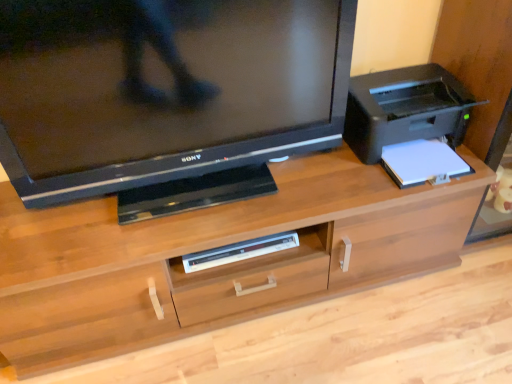
Question: From the image's perspective, is wooden desk at center on matte black television at upper left?

Choices:
 (A) yes
 (B) no

Answer: (B)

Question: Is matte black television at upper left completely or partially inside wooden desk at center?

Choices:
 (A) yes
 (B) no

Answer: (B)

Question: Is wooden desk at center at the left side of matte black television at upper left?

Choices:
 (A) no
 (B) yes

Answer: (A)

Question: Would you say wooden desk at center is outside matte black television at upper left?

Choices:
 (A) no
 (B) yes

Answer: (B)

Question: Is wooden desk at center far from matte black television at upper left?

Choices:
 (A) yes
 (B) no

Answer: (B)

Question: Is matte black television at upper left in front of or behind white plastic dvd player at center in the image?

Choices:
 (A) behind
 (B) front

Answer: (B)

Question: In terms of width, does matte black television at upper left look wider or thinner when compared to white plastic dvd player at center?

Choices:
 (A) wide
 (B) thin

Answer: (A)

Question: Is matte black television at upper left spatially inside white plastic dvd player at center, or outside of it?

Choices:
 (A) inside
 (B) outside

Answer: (B)

Question: Is matte black television at upper left taller or shorter than white plastic dvd player at center?

Choices:
 (A) tall
 (B) short

Answer: (A)

Question: Looking at their shapes, would you say white plastic dvd player at center is wider or thinner than matte black television at upper left?

Choices:
 (A) thin
 (B) wide

Answer: (A)

Question: In the image, is white plastic dvd player at center on the left side or the right side of matte black television at upper left?

Choices:
 (A) left
 (B) right

Answer: (B)

Question: Is white plastic dvd player at center spatially inside matte black television at upper left, or outside of it?

Choices:
 (A) inside
 (B) outside

Answer: (B)

Question: From the image's perspective, is white plastic dvd player at center located above or below matte black television at upper left?

Choices:
 (A) below
 (B) above

Answer: (A)

Question: Relative to wooden desk at center, is matte black television at upper left in front or behind?

Choices:
 (A) front
 (B) behind

Answer: (A)

Question: Would you say matte black television at upper left is to the left or to the right of wooden desk at center in the picture?

Choices:
 (A) right
 (B) left

Answer: (B)